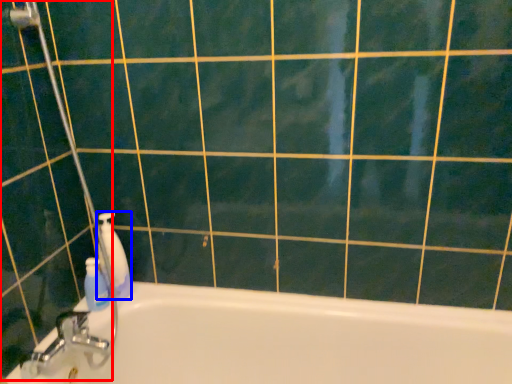
Question: Which object is closer to the camera taking this photo, shower door (highlighted by a red box) or cleaning product (highlighted by a blue box)?

Choices:
 (A) shower door
 (B) cleaning product

Answer: (A)